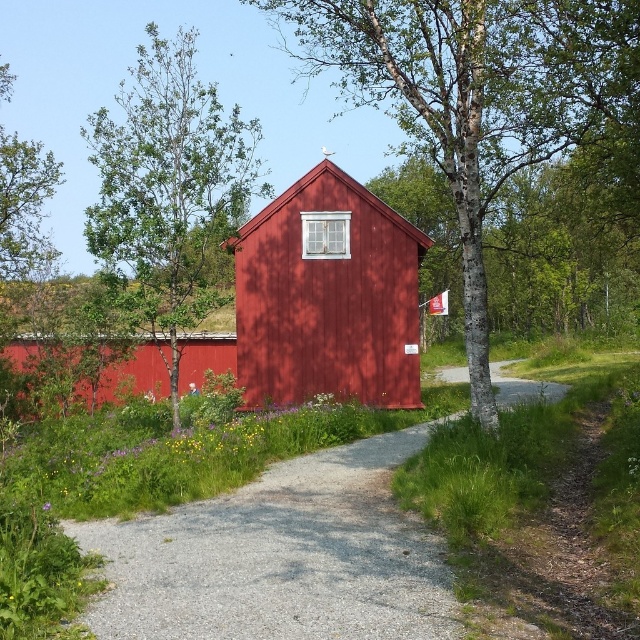
You are a painter setting up your easel to capture the rural scene. You want to ensure that the bark textured tree at center and the green leafy tree at left are both visible in your painting. Based on their widths, which tree should you position closer to the edge of the canvas to maintain balance?

The bark textured tree at center has a lesser width compared to the green leafy tree at left. To balance the composition, position the wider green leafy tree at left closer to the edge of the canvas, allowing the narrower bark textured tree at center to be placed more centrally for visual equilibrium.

Consider the image. You are planning to walk from the gravel path at center to the green leafy tree at left. Based on their sizes, which one do you think is narrower?

The gravel path at center has a smaller size compared to the green leafy tree at left, so the gravel path at center is narrower.

You are a gardener trying to walk from the gravel path at center to the green leafy tree at left. Considering their widths, which one is narrower?

The gravel path at center has a lesser width compared to the green leafy tree at left, so the gravel path at center is narrower.